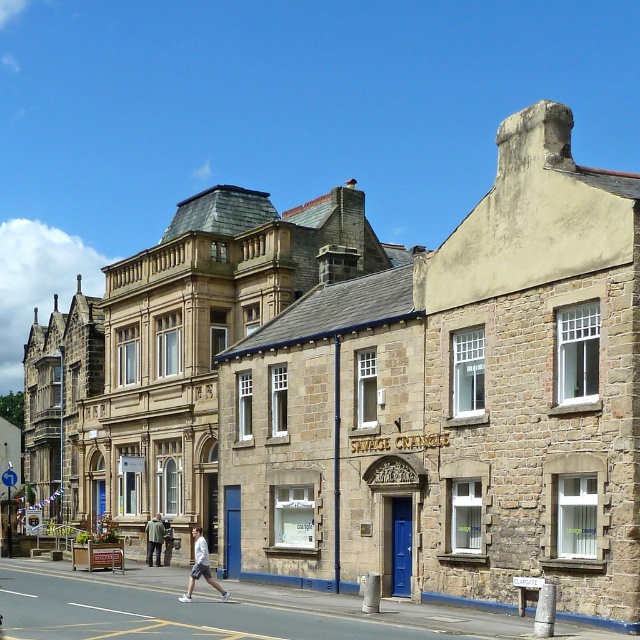
You are a tailor who needs to determine which garment has a greater width when laid flat. You have the light gray cotton shorts at center and the light gray fabric jacket at center. Which one is wider?

The light gray cotton shorts at center has a greater width than the light gray fabric jacket at center when laid flat.

In the scene shown: You are a customer in a store and see two jackets displayed at the center of the store. The khaki fabric jacket at center and the light gray fabric jacket at center. Which jacket is located to the left of the other?

The khaki fabric jacket at center is positioned on the left side of light gray fabric jacket at center.

You are a customer in a clothing store and see two jackets displayed at the center of the store. The khaki fabric jacket at center and the light gray fabric jacket at center. Which jacket is closer to you?

The khaki fabric jacket at center is closer to you because it is in front of the light gray fabric jacket at center.